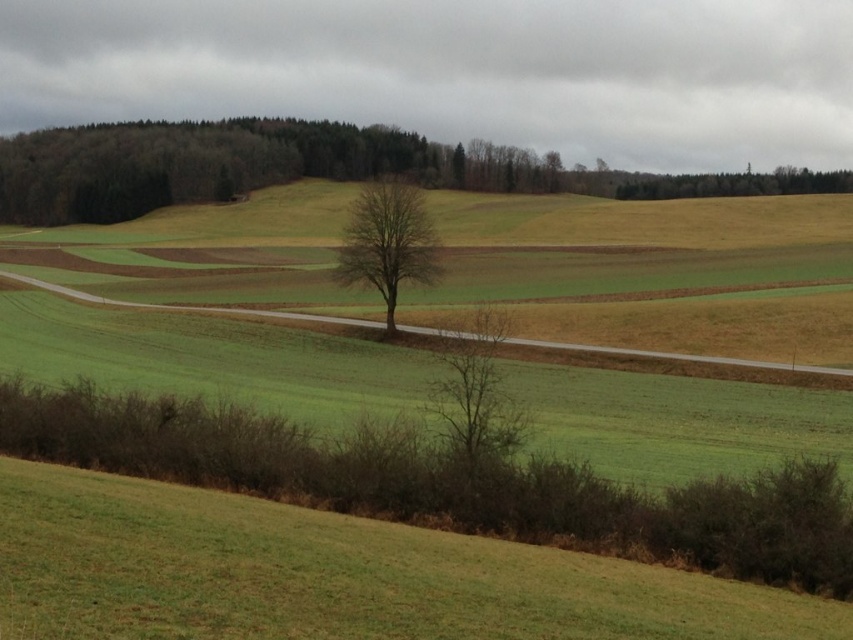
Who is taller, green grassy at lower left or green leafy tree at upper right?

With more height is green leafy tree at upper right.

Which is above, green grassy at lower left or green leafy tree at upper right?

green leafy tree at upper right is higher up.

Is point (20, 616) positioned after point (799, 188)?

That is False.

Locate an element on the screen. The width and height of the screenshot is (853, 640). green grassy at lower left is located at coordinates (332, 576).

Who is positioned more to the right, bare branches at center or bare brown tree at center?

From the viewer's perspective, bare branches at center appears more on the right side.

Which of these two, bare branches at center or bare brown tree at center, stands taller?

With more height is bare brown tree at center.

Which is in front, point (465, 406) or point (339, 273)?

Point (465, 406) is in front.

In order to click on bare branches at center in this screenshot , I will do `click(474, 390)`.

How distant is bare tree at upper center from bare brown tree at center?

bare tree at upper center is 689.69 feet from bare brown tree at center.

Who is positioned more to the left, bare tree at upper center or bare brown tree at center?

bare brown tree at center

This screenshot has height=640, width=853. What do you see at coordinates (303, 168) in the screenshot?
I see `bare tree at upper center` at bounding box center [303, 168].

Locate an element on the screen. The height and width of the screenshot is (640, 853). bare tree at upper center is located at coordinates (x=303, y=168).